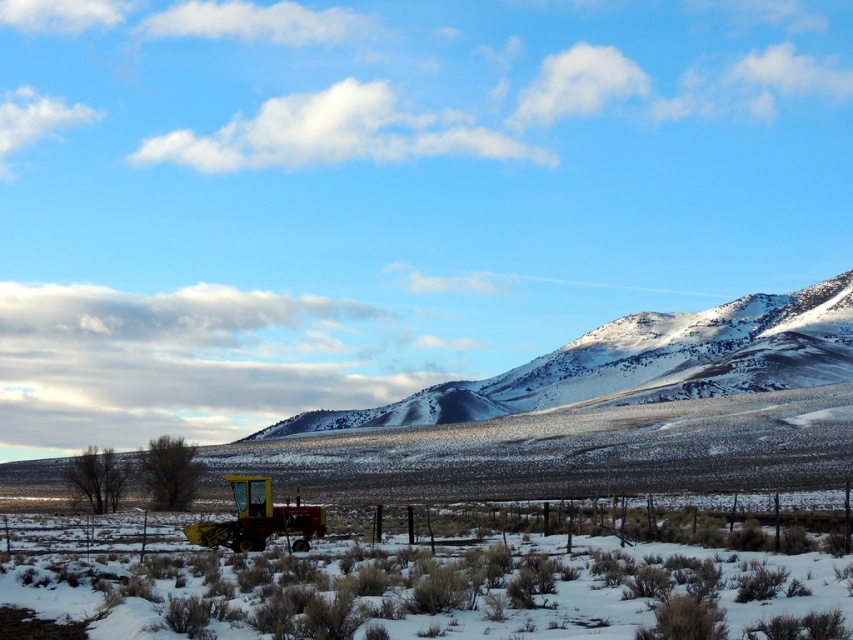
Does snowy rocky mountain at center appear on the right side of red matte tractor at lower left?

Yes, snowy rocky mountain at center is to the right of red matte tractor at lower left.

Which is in front, point (758, 388) or point (245, 490)?

Point (245, 490) is more forward.

Is point (721, 337) closer to camera compared to point (322, 509)?

No, (721, 337) is behind (322, 509).

Where is `snowy rocky mountain at center`? The height and width of the screenshot is (640, 853). snowy rocky mountain at center is located at coordinates (642, 362).